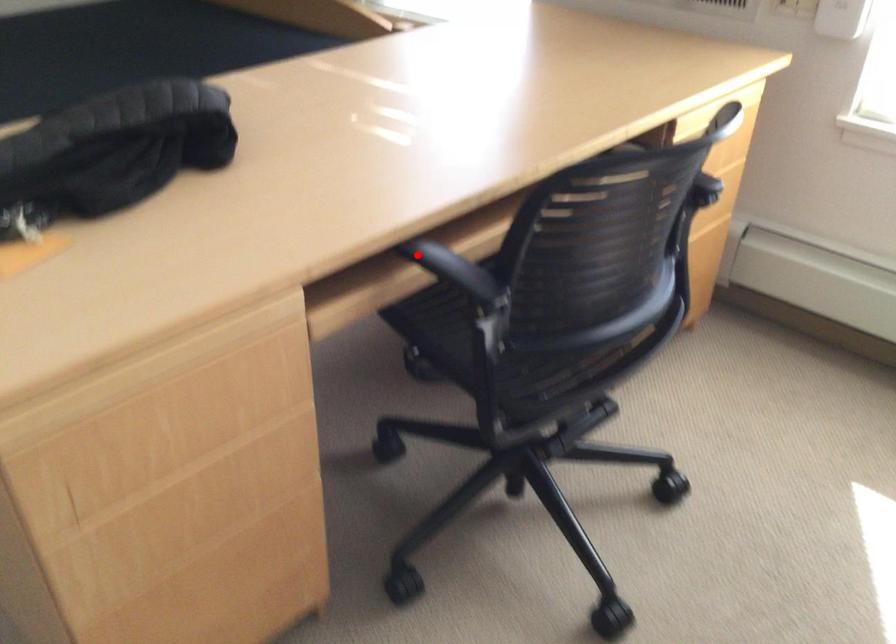
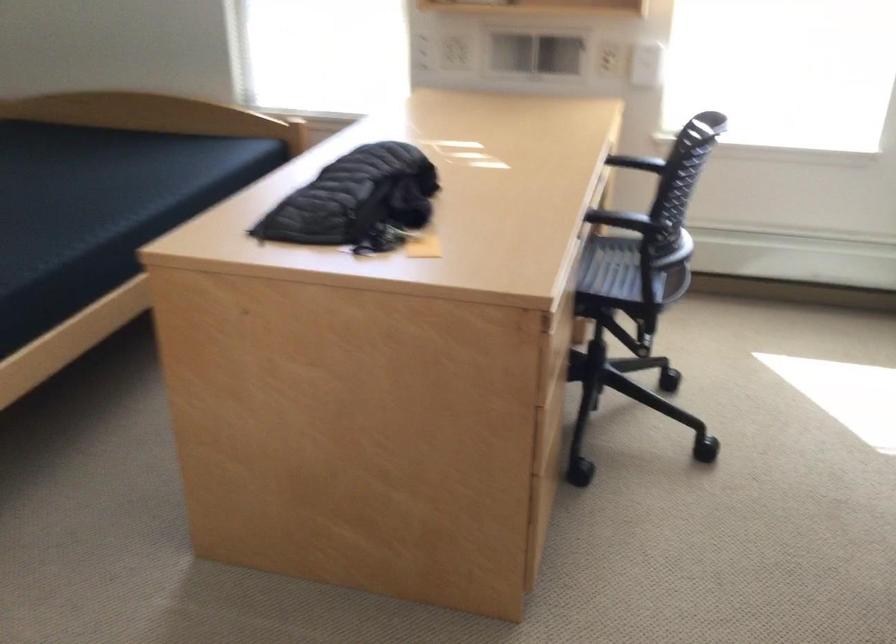
Where in the second image is the point corresponding to the highlighted location from the first image?

(597, 216)